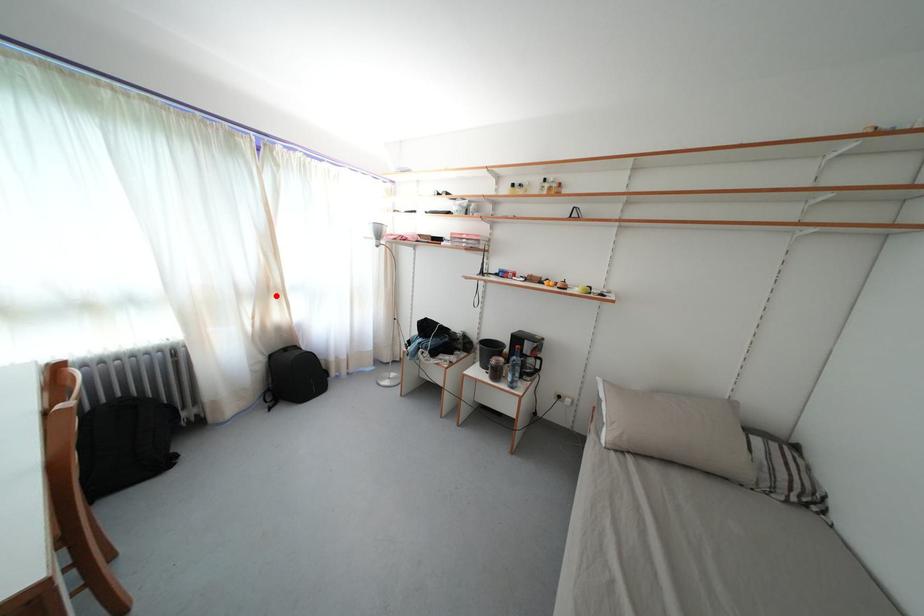
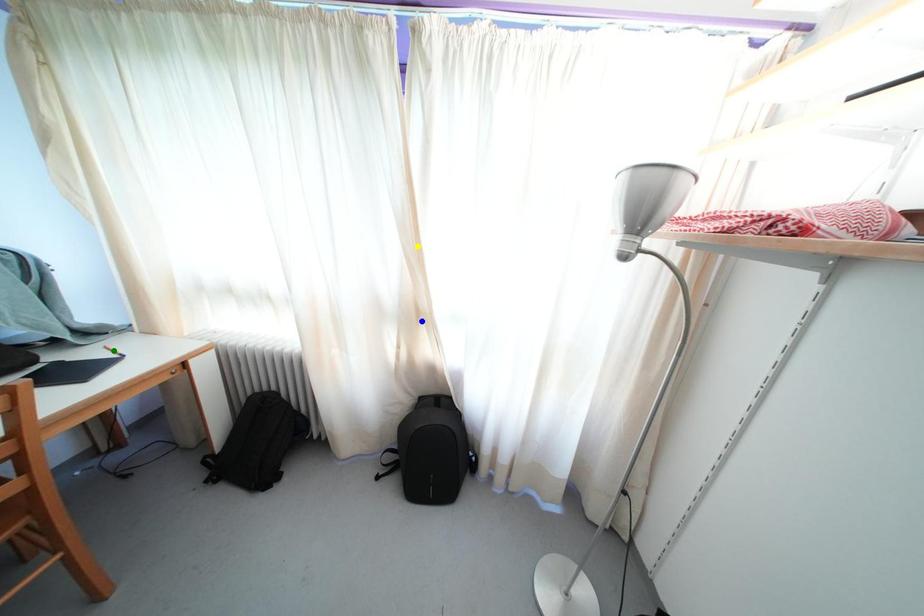
Question: I am providing you with two images of the same scene from different viewpoints. A red point is marked on the first image. You are given multiple points on the second image. Which mark in image 2 goes with the point in image 1?

Choices:
 (A) yellow point
 (B) green point
 (C) blue point

Answer: (C)